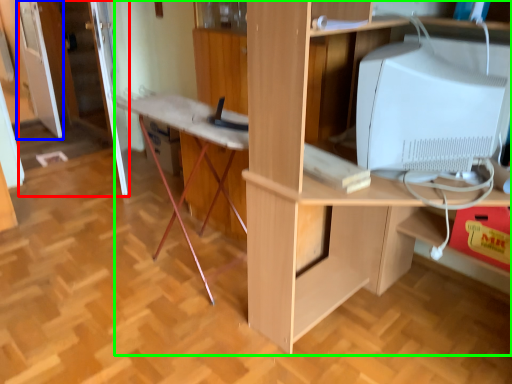
Question: Based on their relative distances, which object is nearer to door (highlighted by a red box)? Choose from glass door (highlighted by a blue box) and desk (highlighted by a green box).

Choices:
 (A) glass door
 (B) desk

Answer: (A)